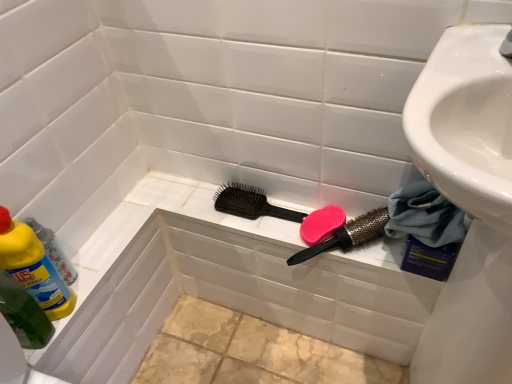
Question: Is there a large distance between blue fabric towel at lower right and black plastic hairbrush at center, which ranks as the second brush in right-to-left order?

Choices:
 (A) yes
 (B) no

Answer: (B)

Question: Can you confirm if blue fabric towel at lower right is positioned to the right of black plastic hairbrush at center, which ranks as the second brush in right-to-left order?

Choices:
 (A) no
 (B) yes

Answer: (B)

Question: Can you confirm if blue fabric towel at lower right is shorter than black plastic hairbrush at center, the first brush when ordered from left to right?

Choices:
 (A) no
 (B) yes

Answer: (A)

Question: Can you confirm if blue fabric towel at lower right is bigger than black plastic hairbrush at center, which ranks as the second brush in right-to-left order?

Choices:
 (A) no
 (B) yes

Answer: (B)

Question: From a real-world perspective, is blue fabric towel at lower right located beneath black plastic hairbrush at center, which ranks as the second brush in right-to-left order?

Choices:
 (A) yes
 (B) no

Answer: (B)

Question: Is blue fabric towel at lower right behind black plastic hairbrush at center, the first brush when ordered from left to right?

Choices:
 (A) yes
 (B) no

Answer: (B)

Question: Is pink rubber brush at center, arranged as the 2th brush when viewed from the left, looking in the opposite direction of black plastic hairbrush at center, which ranks as the second brush in right-to-left order?

Choices:
 (A) no
 (B) yes

Answer: (A)

Question: Is pink rubber brush at center, the first brush in the right-to-left sequence, outside of black plastic hairbrush at center, the first brush when ordered from left to right?

Choices:
 (A) yes
 (B) no

Answer: (A)

Question: Does pink rubber brush at center, arranged as the 2th brush when viewed from the left, appear on the left side of black plastic hairbrush at center, which ranks as the second brush in right-to-left order?

Choices:
 (A) yes
 (B) no

Answer: (B)

Question: Is there a large distance between pink rubber brush at center, the first brush in the right-to-left sequence, and black plastic hairbrush at center, which ranks as the second brush in right-to-left order?

Choices:
 (A) no
 (B) yes

Answer: (A)

Question: Considering the relative sizes of pink rubber brush at center, arranged as the 2th brush when viewed from the left, and black plastic hairbrush at center, which ranks as the second brush in right-to-left order, in the image provided, is pink rubber brush at center, arranged as the 2th brush when viewed from the left, bigger than black plastic hairbrush at center, which ranks as the second brush in right-to-left order,?

Choices:
 (A) yes
 (B) no

Answer: (A)

Question: From the image's perspective, is pink rubber brush at center, arranged as the 2th brush when viewed from the left, above black plastic hairbrush at center, which ranks as the second brush in right-to-left order?

Choices:
 (A) yes
 (B) no

Answer: (B)

Question: Is pink matte comb at center oriented away from black plastic hairbrush at center, the first brush when ordered from left to right?

Choices:
 (A) yes
 (B) no

Answer: (B)